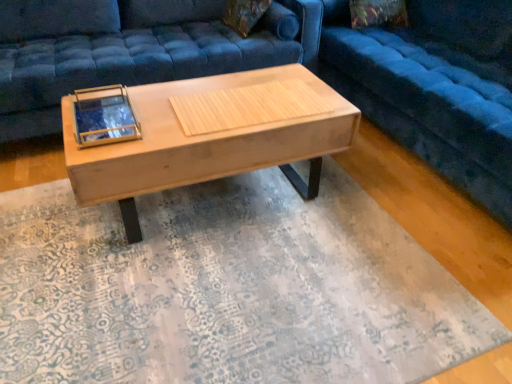
Question: Does velvet blue studio couch at center, which is the 2th studio couch in left-to-right order, appear on the left side of natural wood coffee table at center?

Choices:
 (A) yes
 (B) no

Answer: (B)

Question: Is natural wood coffee table at center a part of velvet blue studio couch at center, which is the 2th studio couch in left-to-right order?

Choices:
 (A) yes
 (B) no

Answer: (B)

Question: From a real-world perspective, is velvet blue studio couch at center, acting as the 1th studio couch starting from the right, located higher than natural wood coffee table at center?

Choices:
 (A) no
 (B) yes

Answer: (B)

Question: Does velvet blue studio couch at center, acting as the 1th studio couch starting from the right, touch natural wood coffee table at center?

Choices:
 (A) yes
 (B) no

Answer: (B)

Question: Can you confirm if velvet blue studio couch at center, which is the 2th studio couch in left-to-right order, is wider than natural wood coffee table at center?

Choices:
 (A) no
 (B) yes

Answer: (B)

Question: Relative to natural wood coffee table at center, is velvet blue studio couch at center, acting as the 1th studio couch starting from the right, in front or behind?

Choices:
 (A) front
 (B) behind

Answer: (A)

Question: In terms of size, does velvet blue studio couch at center, which is the 2th studio couch in left-to-right order, appear bigger or smaller than natural wood coffee table at center?

Choices:
 (A) big
 (B) small

Answer: (A)

Question: From the image's perspective, is velvet blue studio couch at center, which is the 2th studio couch in left-to-right order, above or below natural wood coffee table at center?

Choices:
 (A) above
 (B) below

Answer: (A)

Question: From their relative heights in the image, would you say velvet blue studio couch at center, acting as the 1th studio couch starting from the right, is taller or shorter than natural wood coffee table at center?

Choices:
 (A) short
 (B) tall

Answer: (B)

Question: Looking at the image, does velvet blue studio couch at center, arranged as the first studio couch when viewed from the left, seem bigger or smaller compared to natural wood coffee table at center?

Choices:
 (A) small
 (B) big

Answer: (B)

Question: Is point (54, 94) positioned closer to the camera than point (135, 190)?

Choices:
 (A) farther
 (B) closer

Answer: (A)

Question: Is velvet blue studio couch at center, arranged as the first studio couch when viewed from the left, situated inside natural wood coffee table at center or outside?

Choices:
 (A) outside
 (B) inside

Answer: (A)

Question: Is velvet blue studio couch at center, the second studio couch viewed from the right, wider or thinner than natural wood coffee table at center?

Choices:
 (A) wide
 (B) thin

Answer: (A)

Question: Is velvet blue studio couch at center, acting as the 1th studio couch starting from the right, in front of or behind velvet blue studio couch at center, the second studio couch viewed from the right, in the image?

Choices:
 (A) behind
 (B) front

Answer: (B)

Question: Is velvet blue studio couch at center, which is the 2th studio couch in left-to-right order, taller or shorter than velvet blue studio couch at center, the second studio couch viewed from the right?

Choices:
 (A) short
 (B) tall

Answer: (B)